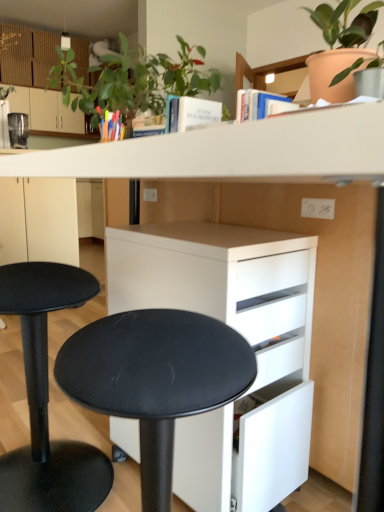
Question: Would you say black matte stool at lower left contains matte beige cabinet at upper left, which is the second cabinetry from bottom to top?

Choices:
 (A) yes
 (B) no

Answer: (B)

Question: Is black matte stool at lower left oriented towards matte beige cabinet at upper left, the second cabinetry viewed from the front?

Choices:
 (A) no
 (B) yes

Answer: (A)

Question: Does black matte stool at lower left appear on the right side of matte beige cabinet at upper left, which is the second cabinetry from bottom to top?

Choices:
 (A) no
 (B) yes

Answer: (B)

Question: Considering the relative sizes of black matte stool at lower left and matte beige cabinet at upper left, placed as the 2th cabinetry when sorted from right to left, in the image provided, is black matte stool at lower left thinner than matte beige cabinet at upper left, placed as the 2th cabinetry when sorted from right to left,?

Choices:
 (A) yes
 (B) no

Answer: (B)

Question: Does black matte stool at lower left have a larger size compared to matte beige cabinet at upper left, which ranks as the first cabinetry in left-to-right order?

Choices:
 (A) no
 (B) yes

Answer: (A)

Question: From the image's perspective, is black matte stool at lower left on matte beige cabinet at upper left, placed as the 2th cabinetry when sorted from right to left?

Choices:
 (A) no
 (B) yes

Answer: (A)

Question: From a real-world perspective, is terracotta clay pot at upper right, positioned as the first houseplant in right-to-left order, positioned over black matte stool at lower left based on gravity?

Choices:
 (A) no
 (B) yes

Answer: (B)

Question: Could you tell me if terracotta clay pot at upper right, which is the second houseplant in left-to-right order, is turned towards black matte stool at lower left?

Choices:
 (A) no
 (B) yes

Answer: (A)

Question: From the image's perspective, is terracotta clay pot at upper right, positioned as the first houseplant in right-to-left order, located beneath black matte stool at lower left?

Choices:
 (A) no
 (B) yes

Answer: (A)

Question: Does terracotta clay pot at upper right, which is the second houseplant in left-to-right order, contain black matte stool at lower left?

Choices:
 (A) no
 (B) yes

Answer: (A)

Question: From a real-world perspective, is terracotta clay pot at upper right, positioned as the first houseplant in right-to-left order, physically below black matte stool at lower left?

Choices:
 (A) no
 (B) yes

Answer: (A)

Question: Is terracotta clay pot at upper right, positioned as the first houseplant in right-to-left order, at the left side of black matte stool at lower left?

Choices:
 (A) no
 (B) yes

Answer: (A)

Question: Is black matte stool at lower left turned away from matte black coffee maker at left?

Choices:
 (A) no
 (B) yes

Answer: (A)